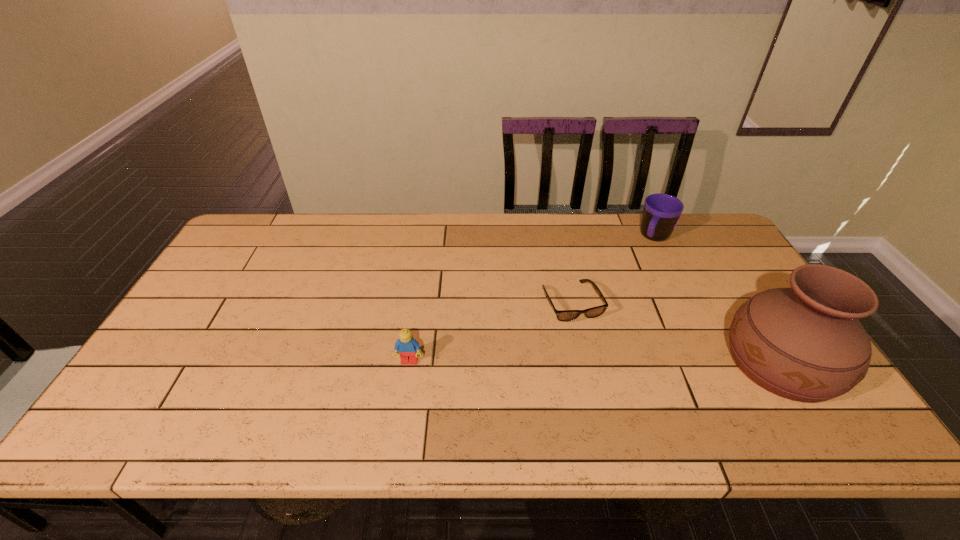
This screenshot has height=540, width=960. Identify the location of vacant space on the desktop that is between the leftmost object and the urn and is positioned with the handle on the side of the mug. (578, 362).

The height and width of the screenshot is (540, 960). I want to click on free spot on the desktop that is between the leftmost object and the tallest object and is positioned on the lenses of the shortest object, so coord(600,362).